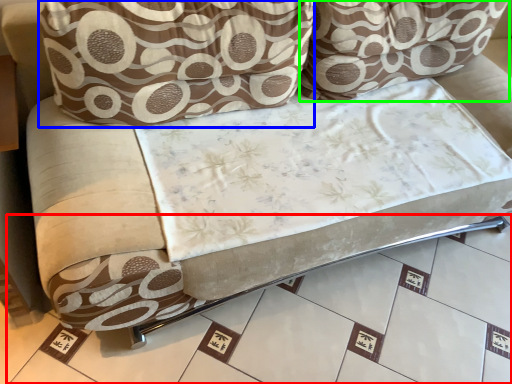
Question: Based on their relative distances, which object is nearer to tile (highlighted by a red box)? Choose from throw pillow (highlighted by a blue box) and throw pillow (highlighted by a green box).

Choices:
 (A) throw pillow
 (B) throw pillow

Answer: (A)